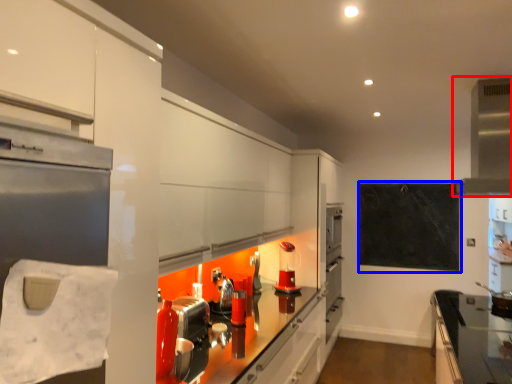
Question: Which object is closer to the camera taking this photo, exhaust hood (highlighted by a red box) or bulletin board (highlighted by a blue box)?

Choices:
 (A) exhaust hood
 (B) bulletin board

Answer: (A)